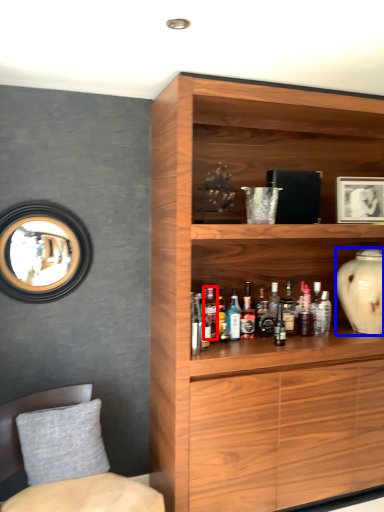
Question: Which of the following is the farthest to the observer, bottle (highlighted by a red box) or vase (highlighted by a blue box)?

Choices:
 (A) bottle
 (B) vase

Answer: (B)